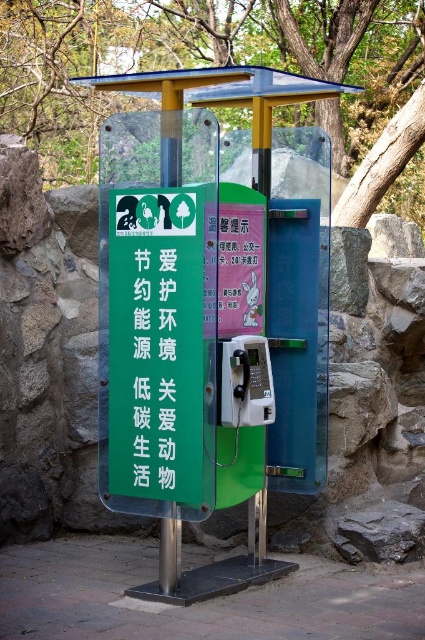
You are a maintenance worker who needs to inspect both the green plastic tree at upper center and the metallic gray payphone at center. Which object should you check first if you want to start with the one closer to you?

You should check the green plastic tree at upper center first because it is closer to you than the metallic gray payphone at center.

You are a city planner reviewing the layout of a new public space. The scene includes a green metallic bus stop at center and a green matte sign at center. Based on their sizes, which object would be more effective for displaying large public announcements?

The green metallic bus stop at center is larger in size than the green matte sign at center, so it would be more effective for displaying large public announcements.